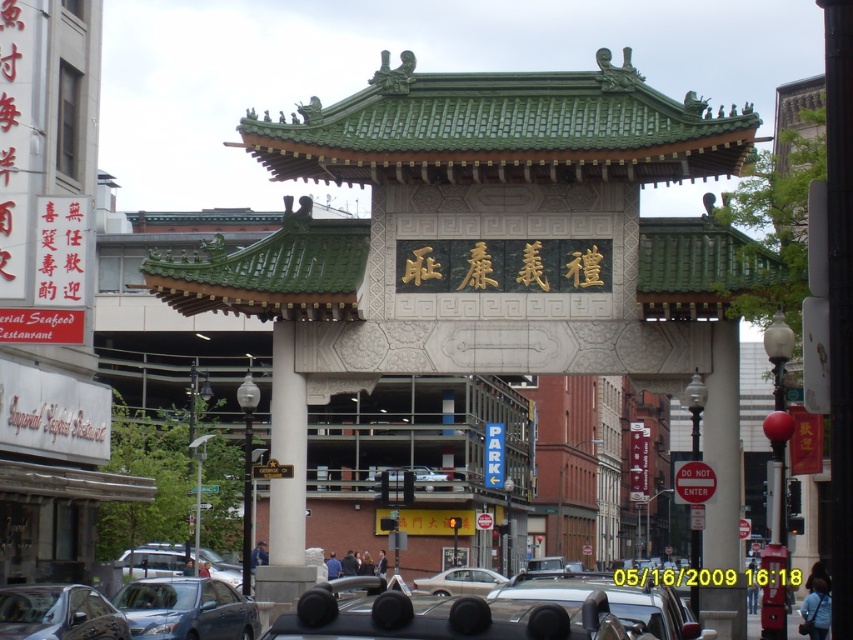
Can you confirm if black metal sign at center is positioned below red plastic sign at center?

Indeed, black metal sign at center is positioned under red plastic sign at center.

Is point (636, 582) more distant than point (677, 467)?

No, it is not.

Looking at this image, who is more forward, (763, 568) or (701, 493)?

Point (763, 568)

This screenshot has width=853, height=640. I want to click on black metal sign at center, so click(674, 577).

Between point (184, 634) and point (700, 481), which one is positioned in front?

Point (184, 634) is in front.

Between metallic silver sedan at center and red plastic sign at center, which one is positioned lower?

metallic silver sedan at center is lower down.

Does point (131, 589) lie in front of point (682, 490)?

That is False.

This screenshot has height=640, width=853. I want to click on metallic silver sedan at center, so click(186, 609).

Who is taller, matte black car at center or red plastic sign at center?

With more height is red plastic sign at center.

Is point (566, 612) positioned in front of point (689, 467)?

Yes, point (566, 612) is in front of point (689, 467).

Locate an element on the screen. The height and width of the screenshot is (640, 853). matte black car at center is located at coordinates (453, 616).